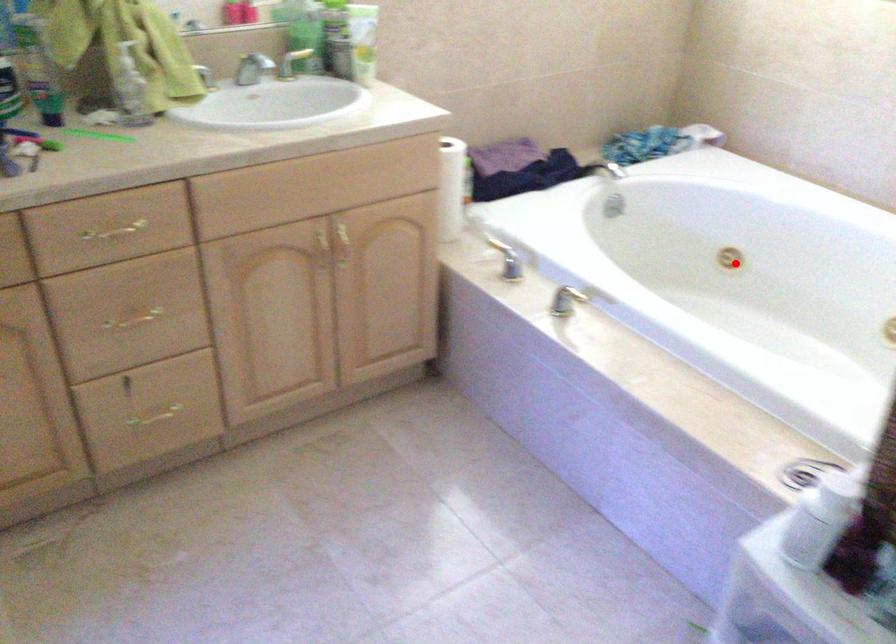
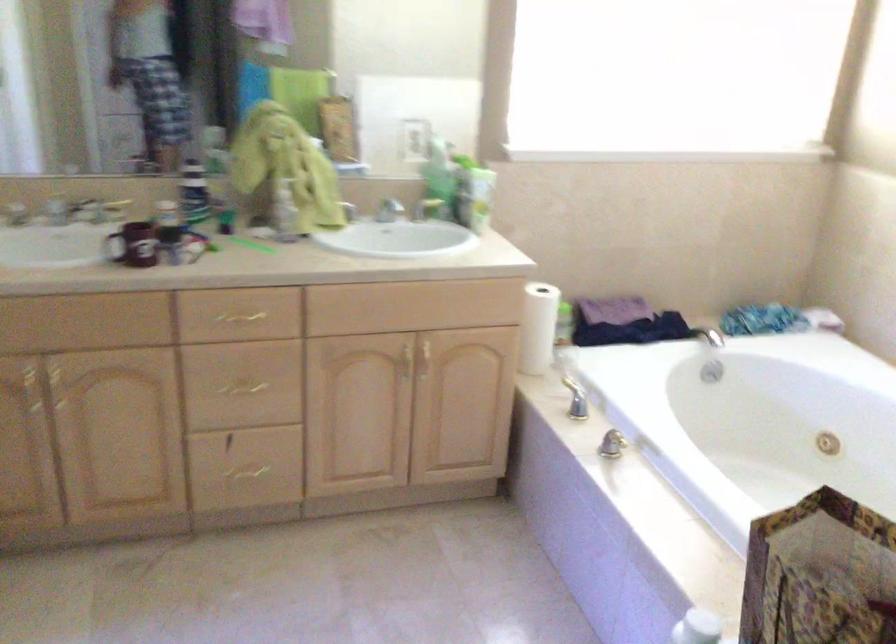
Question: I am providing you with two images of the same scene from different viewpoints. A red point is marked on the first image. At the location where the point appears in image 1, is it still visible in image 2?

Choices:
 (A) Yes
 (B) No

Answer: (A)